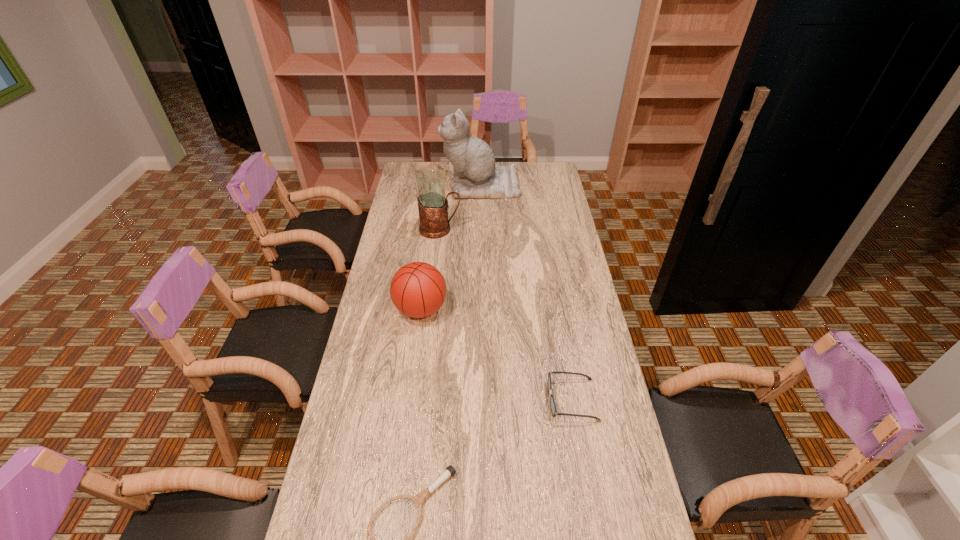
At what (x,y) coordinates should I click in order to perform the action: click on free location that satisfies the following two spatial constraints: 1. with the handle on the side of the fourth shortest object; 2. on the front side of the third tallest object. Please return your answer as a coordinate pair (x, y). Looking at the image, I should click on (431, 309).